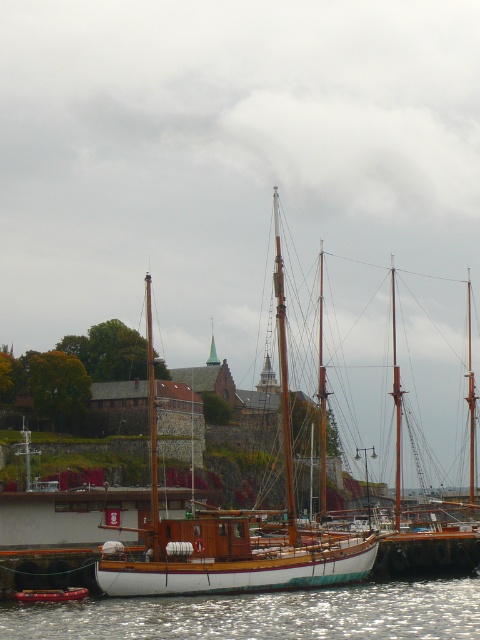
You are a photographer wanting to capture the wooden sailboat at center and the glistening water at lower left in a single shot. Since you want both to be clearly visible, which object should you focus on first to ensure it is in sharp focus?

You should focus on the wooden sailboat at center first because it is larger than the glistening water at lower left, making it easier to capture in sharp focus.

You are standing at the center of the image and want to move to the glistening water at lower left. Which direction should you face to walk directly towards it?

Since the glistening water at lower left is located at point (263, 614), you should face towards the lower left direction to walk directly towards it.

You are standing on the pier and notice the glistening water at lower left and the wooden boat at lower center. Which object is positioned higher from the ground level?

The glistening water at lower left is above the wooden boat at lower center, so it is positioned higher from the ground level.